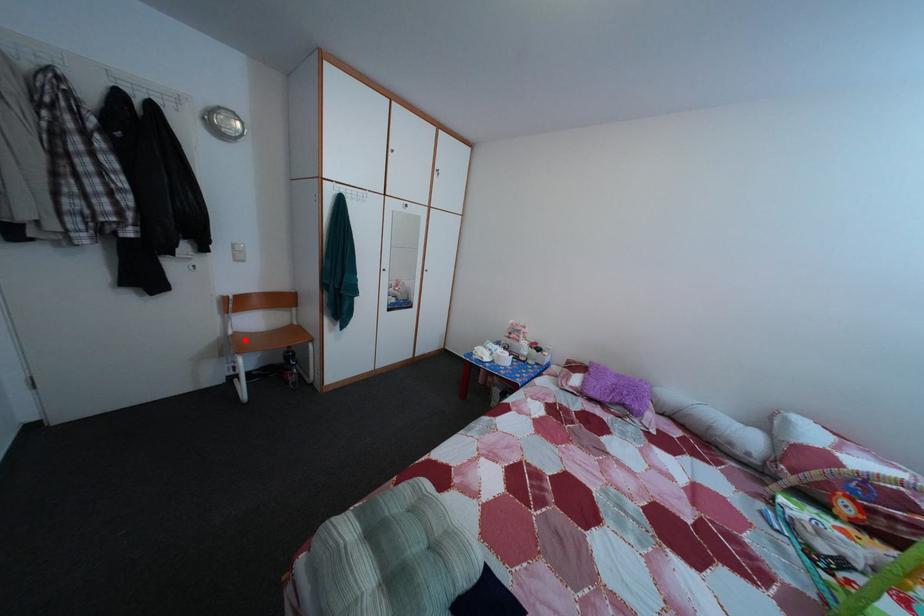
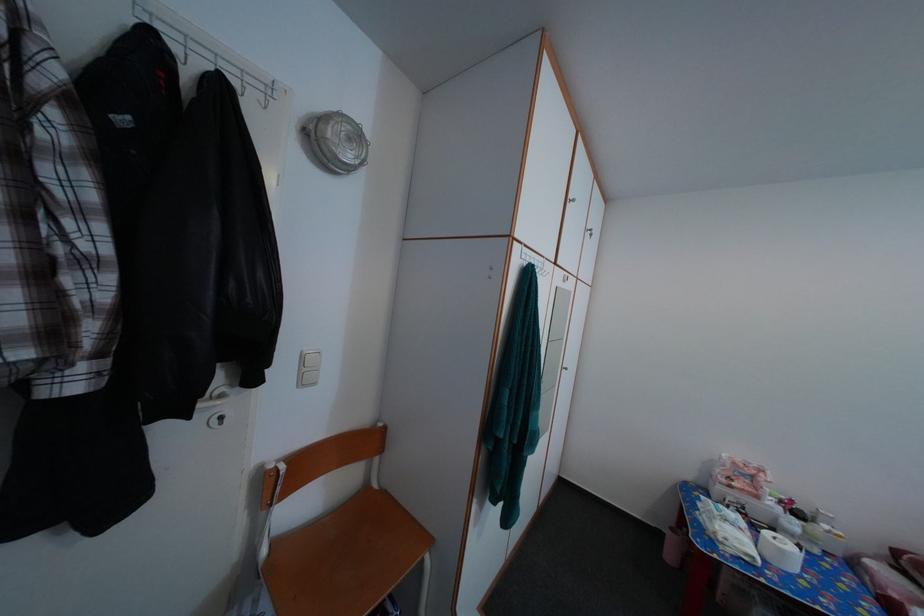
Where in the second image is the point corresponding to the highlighted location from the first image?

(282, 552)